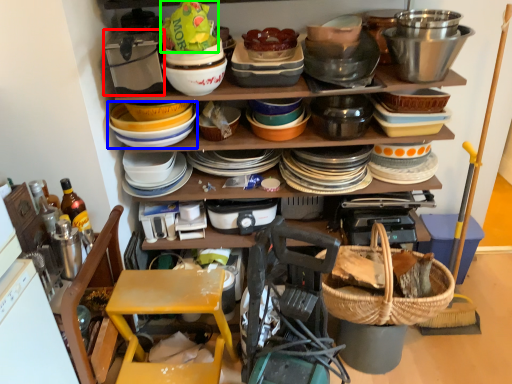
Question: Which object is positioned farthest from appliance (highlighted by a red box)? Select from bowl (highlighted by a blue box) and food (highlighted by a green box).

Choices:
 (A) bowl
 (B) food

Answer: (B)